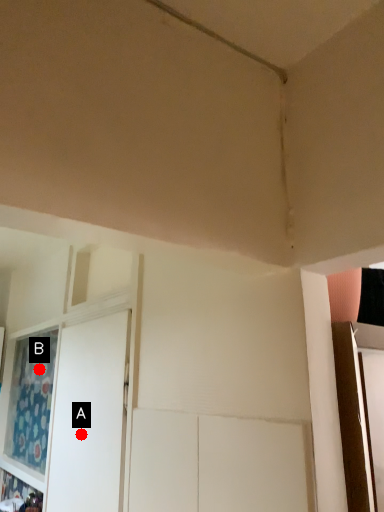
Question: Two points are circled on the image, labeled by A and B beside each circle. Which point is closer to the camera taking this photo?

Choices:
 (A) A is closer
 (B) B is closer

Answer: (A)